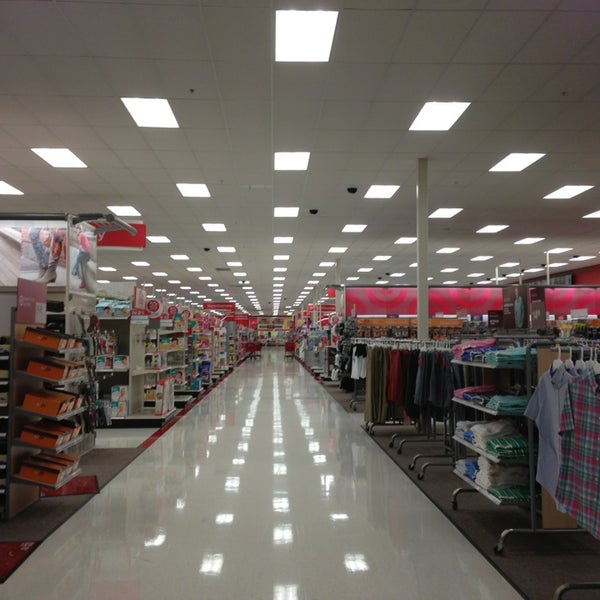
Identify the location of reflections of the ceiling lights on the white floor. The width and height of the screenshot is (600, 600). (278, 467), (282, 533), (208, 561), (356, 561).